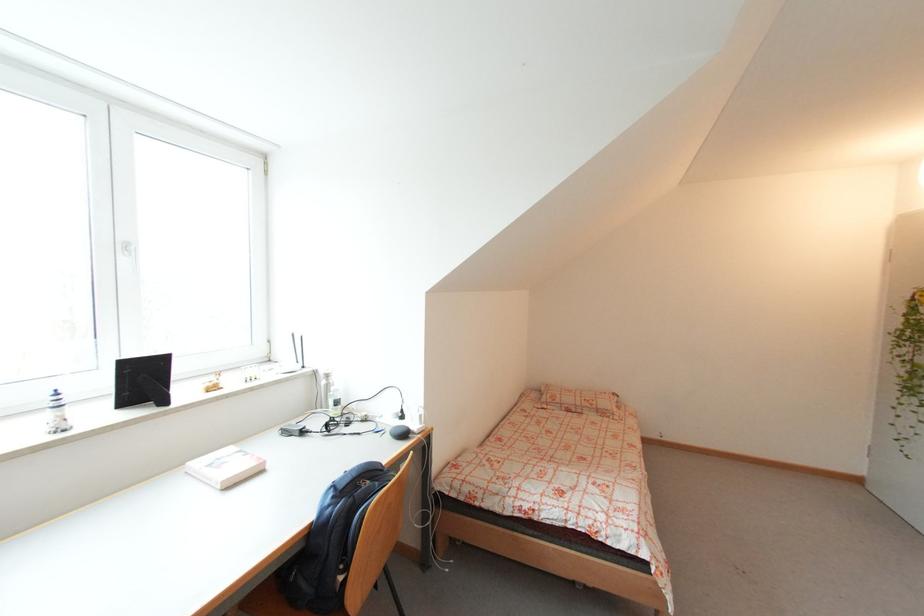
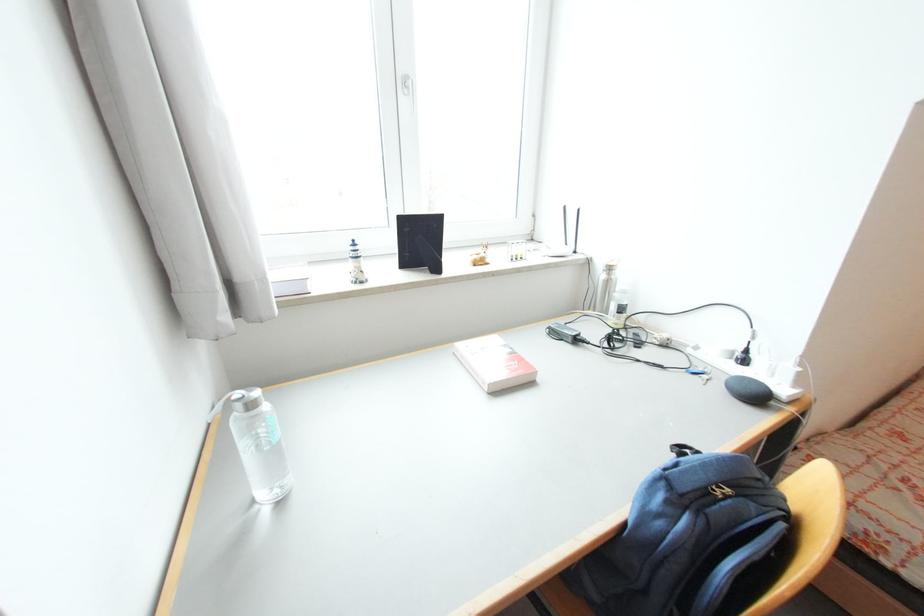
Where in the second image is the point corresponding to point (130, 253) from the first image?

(411, 91)